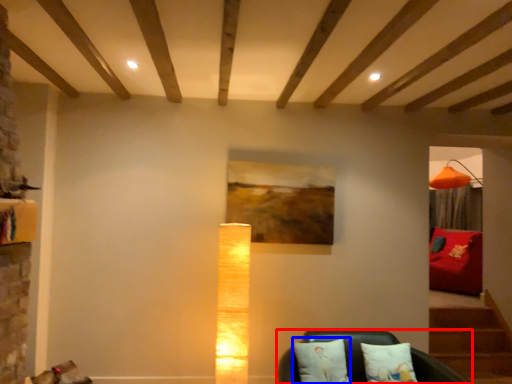
Question: Which object is closer to the camera taking this photo, furniture (highlighted by a red box) or pillow (highlighted by a blue box)?

Choices:
 (A) furniture
 (B) pillow

Answer: (A)